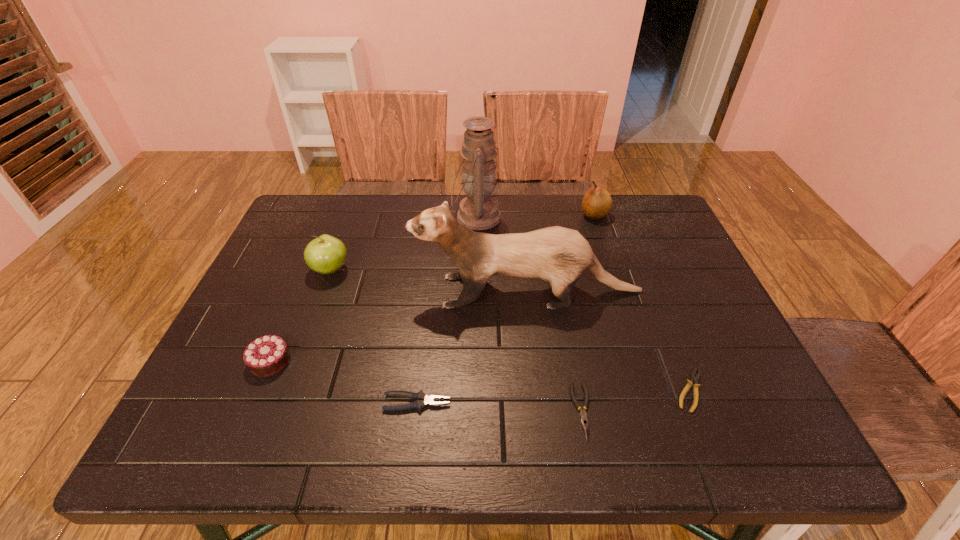
The height and width of the screenshot is (540, 960). In order to click on vacant area situated on the back of the shortest pliers in this screenshot , I will do `click(663, 323)`.

At what (x,y) coordinates should I click in order to perform the action: click on oil lamp situated at the far edge. Please return your answer as a coordinate pair (x, y). Looking at the image, I should click on tap(478, 210).

I want to click on pear located at the far edge, so click(x=597, y=203).

Locate an element on the screen. The width and height of the screenshot is (960, 540). apple at the left edge is located at coordinates (326, 254).

At what (x,y) coordinates should I click in order to perform the action: click on chocolate cake present at the left edge. Please return your answer as a coordinate pair (x, y). Looking at the image, I should click on (268, 355).

The image size is (960, 540). Find the location of `object situated at the right edge`. object situated at the right edge is located at coordinates (695, 377).

I want to click on object positioned at the near right corner, so click(695, 377).

The image size is (960, 540). Find the location of `free space at the far edge of the desktop`. free space at the far edge of the desktop is located at coordinates (537, 227).

At what (x,y) coordinates should I click in order to perform the action: click on free space at the near edge. Please return your answer as a coordinate pair (x, y). Image resolution: width=960 pixels, height=540 pixels. Looking at the image, I should click on (643, 449).

Identify the location of free space at the left edge. The height and width of the screenshot is (540, 960). (275, 258).